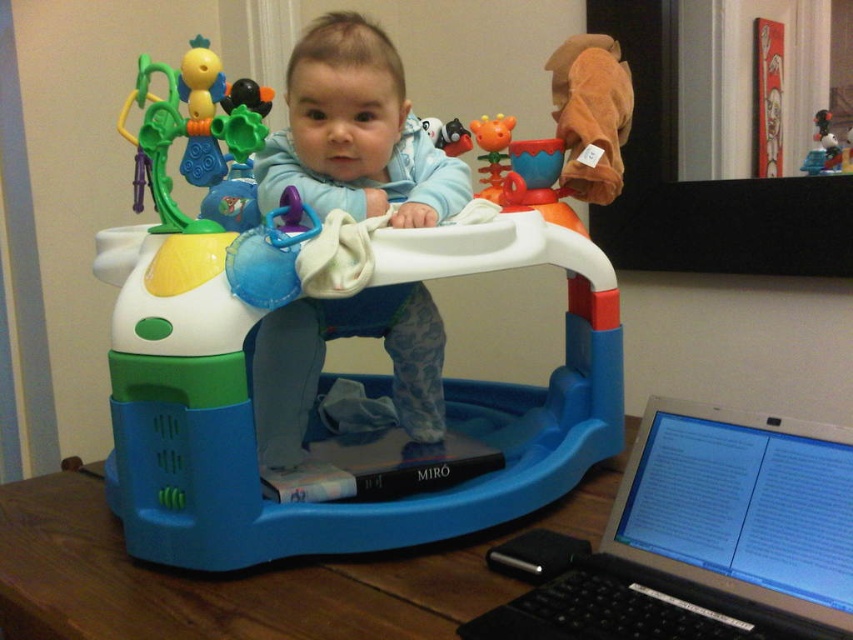
Is blue plastic walker at center to the left of matte plastic toy at upper right from the viewer's perspective?

Indeed, blue plastic walker at center is positioned on the left side of matte plastic toy at upper right.

Which is in front, point (189, 312) or point (833, 138)?

Positioned in front is point (189, 312).

Between point (317, 323) and point (820, 168), which one is positioned in front?

Point (317, 323)

At what (x,y) coordinates should I click in order to perform the action: click on blue plastic walker at center. Please return your answer as a coordinate pair (x, y). This screenshot has width=853, height=640. Looking at the image, I should click on (331, 326).

Between blue plastic walker at center and blue soft walker at center, which one is positioned higher?

blue soft walker at center is above.

Does blue plastic walker at center have a smaller size compared to blue soft walker at center?

No.

Is point (248, 486) farther from viewer compared to point (294, 429)?

No, it is not.

Image resolution: width=853 pixels, height=640 pixels. In order to click on blue plastic walker at center in this screenshot , I will do `click(331, 326)`.

Can you confirm if blue plastic walker at center is positioned below silver metallic laptop at lower right?

Actually, blue plastic walker at center is above silver metallic laptop at lower right.

Looking at this image, can you confirm if blue plastic walker at center is wider than silver metallic laptop at lower right?

Indeed, blue plastic walker at center has a greater width compared to silver metallic laptop at lower right.

Locate an element on the screen. Image resolution: width=853 pixels, height=640 pixels. blue plastic walker at center is located at coordinates (331, 326).

Identify the location of blue plastic walker at center. (331, 326).